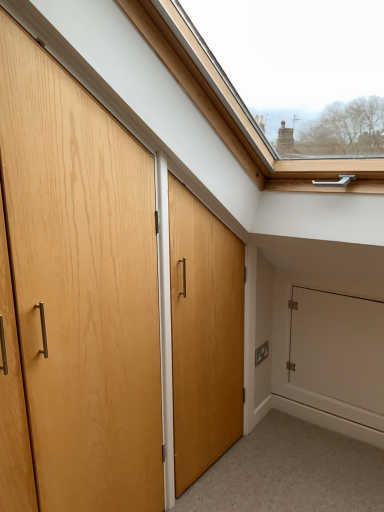
Question: Is point (127, 418) closer or farther from the camera than point (347, 296)?

Choices:
 (A) closer
 (B) farther

Answer: (A)

Question: Relative to white matte door at lower right, is matte wood door at left in front or behind?

Choices:
 (A) behind
 (B) front

Answer: (B)

Question: From a real-world perspective, is matte wood door at left physically located above or below white matte door at lower right?

Choices:
 (A) below
 (B) above

Answer: (B)

Question: From the image's perspective, relative to matte wood door at left, is white matte door at lower right above or below?

Choices:
 (A) above
 (B) below

Answer: (B)

Question: Considering the positions of white matte door at lower right and matte wood door at left in the image, is white matte door at lower right wider or thinner than matte wood door at left?

Choices:
 (A) wide
 (B) thin

Answer: (B)

Question: In the image, is white matte door at lower right positioned in front of or behind matte wood door at left?

Choices:
 (A) behind
 (B) front

Answer: (A)

Question: In terms of size, does white matte door at lower right appear bigger or smaller than matte wood door at left?

Choices:
 (A) small
 (B) big

Answer: (A)